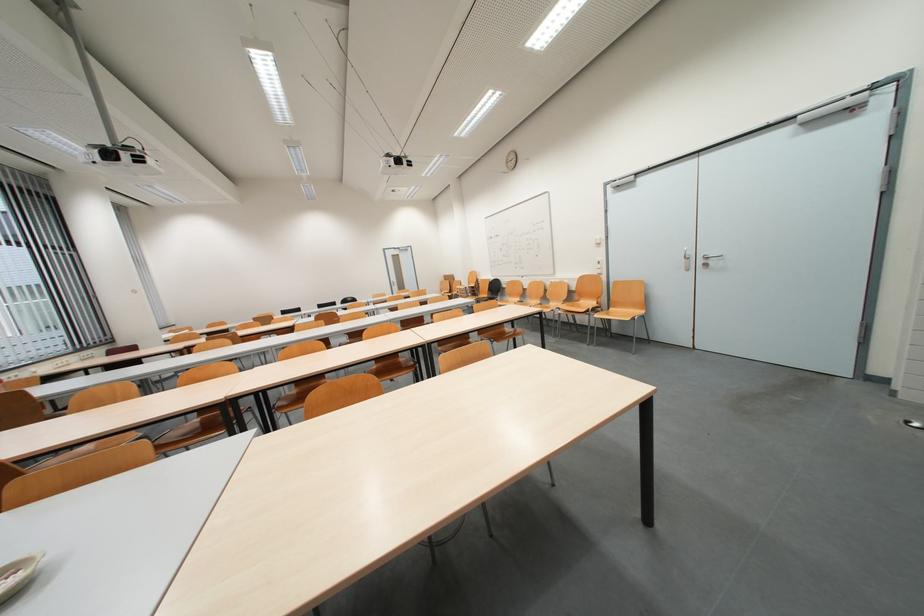
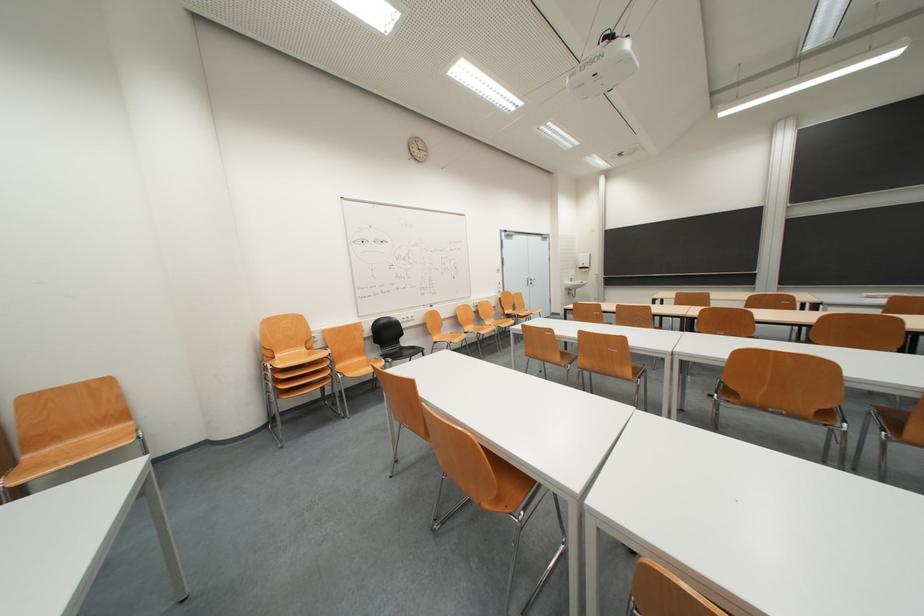
Question: I am providing you with two images of the same scene from different viewpoints. Please identify which objects are invisible in image2.

Choices:
 (A) chair sitting surface
 (B) metal door handle
 (C) red handled tool
 (D) sink faucet lever

Answer: (A)